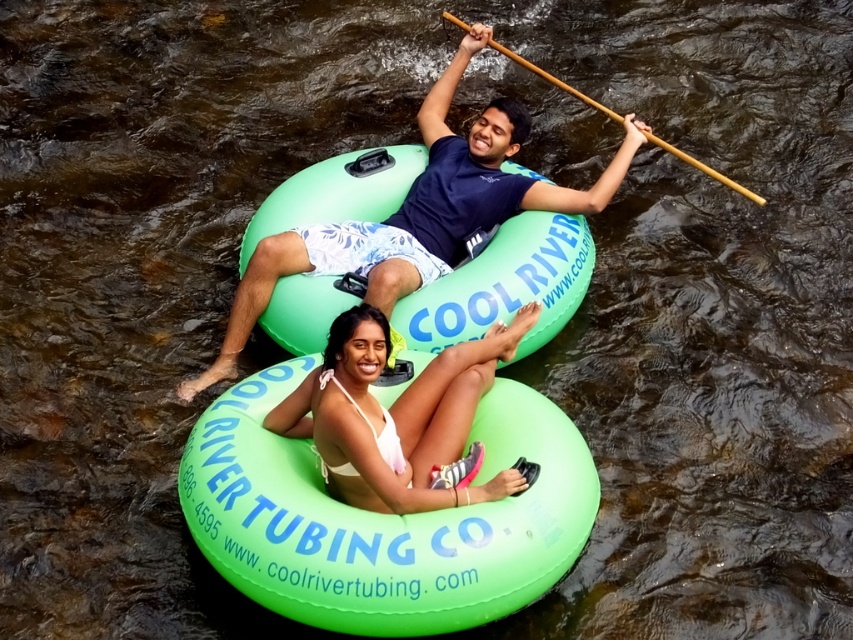
In the scene shown: You are a photographer trying to capture a photo of the matte green tube at center and the white bikini bottom at center. Since you want both subjects in the frame, which direction should you move your camera to ensure both are visible?

The matte green tube at center is to the left of the white bikini bottom at center, so you should move your camera slightly to the right to include both subjects in the frame.

You are planning to take a photo of the scene with a camera that has a limited field of view. You want to capture both the matte green tube at center and the white bikini bottom at center in the same frame. Considering their sizes, which object should you position closer to the camera to ensure both fit within the frame?

Since the matte green tube at center is wider than the white bikini bottom at center, you should position the matte green tube at center closer to the camera. This way, its larger size will be more in focus and both objects will fit within the frame.